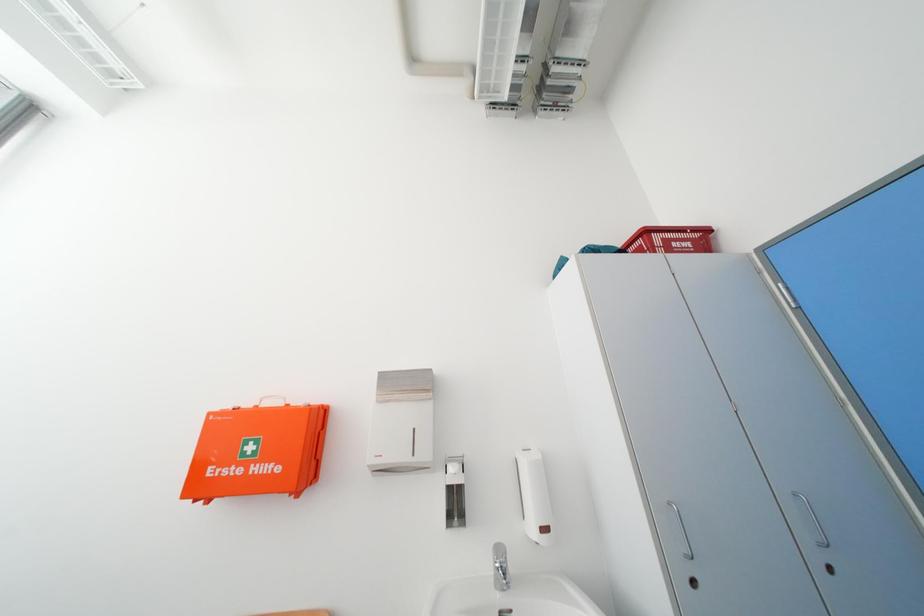
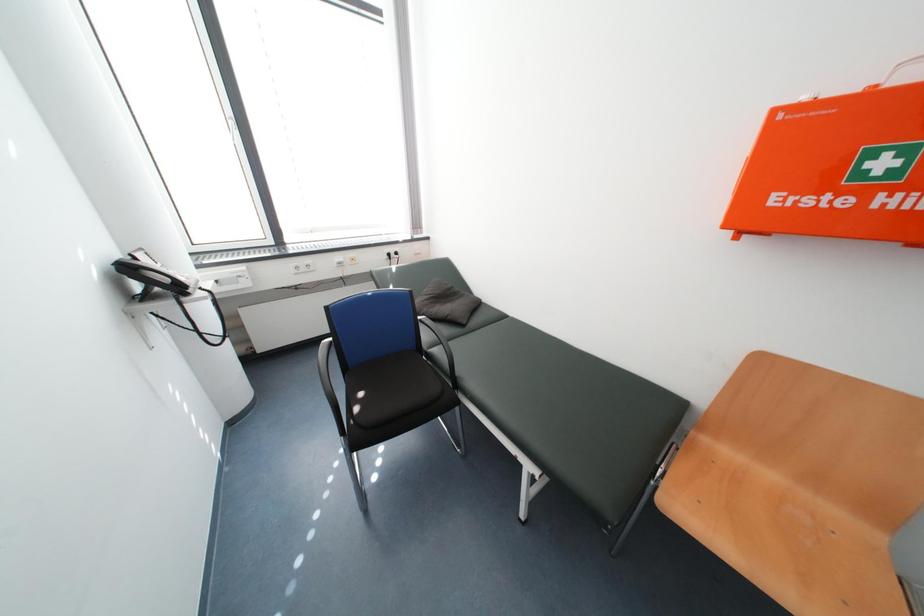
How did the camera likely rotate?

The camera's rotation is toward left-down.